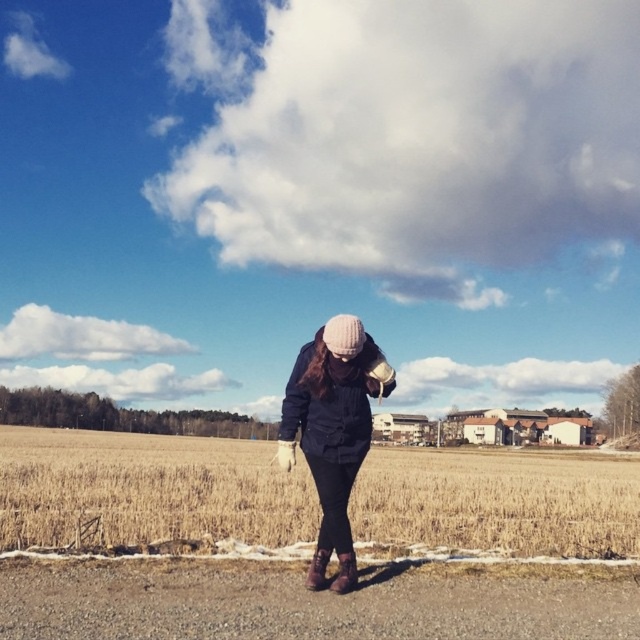
Question: Which point is farther to the camera?

Choices:
 (A) brown suede boot at lower center
 (B) brown grass at center

Answer: (B)

Question: Does brown grass at center appear on the right side of matte black jacket at center?

Choices:
 (A) yes
 (B) no

Answer: (B)

Question: Can you confirm if brown grass at center is positioned to the left of brown suede boot at lower center?

Choices:
 (A) no
 (B) yes

Answer: (B)

Question: Which point appears farthest from the camera in this image?

Choices:
 (A) (332, 586)
 (B) (324, 557)

Answer: (B)

Question: Estimate the real-world distances between objects in this image. Which object is farther from the brown grass at center?

Choices:
 (A) brown suede boot at lower center
 (B) brown leather boot at lower center
 (C) matte black jacket at center

Answer: (B)

Question: Does brown suede boot at lower center appear under brown leather boot at lower center?

Choices:
 (A) no
 (B) yes

Answer: (A)